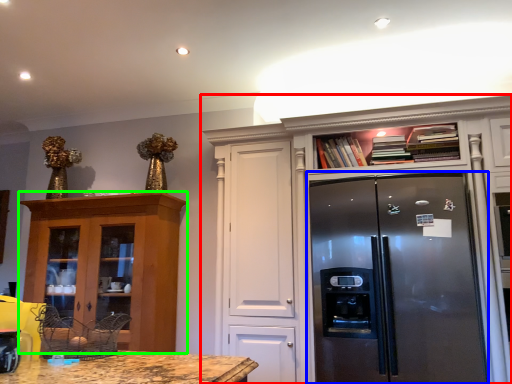
Question: Which object is the farthest from cabinetry (highlighted by a red box)? Choose among these: refrigerator (highlighted by a blue box) or cabinetry (highlighted by a green box).

Choices:
 (A) refrigerator
 (B) cabinetry

Answer: (B)